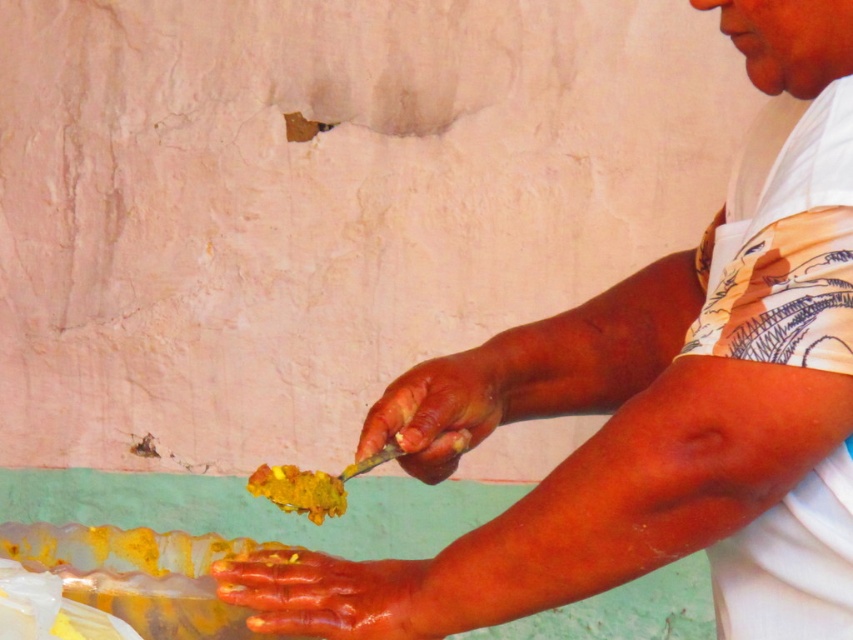
Does orange painted skin at lower center appear under yellowish matte paintbrush at center?

Correct, orange painted skin at lower center is located below yellowish matte paintbrush at center.

Can you confirm if orange painted skin at lower center is positioned to the left of yellowish matte paintbrush at center?

Yes, orange painted skin at lower center is to the left of yellowish matte paintbrush at center.

Locate an element on the screen. The image size is (853, 640). orange painted skin at lower center is located at coordinates point(325,595).

The width and height of the screenshot is (853, 640). Identify the location of orange painted skin at lower center. (325, 595).

What do you see at coordinates (444, 410) in the screenshot? I see `yellowish matte paintbrush at center` at bounding box center [444, 410].

How distant is yellowish matte paintbrush at center from yellow matte food at center?

yellowish matte paintbrush at center is 3.21 inches away from yellow matte food at center.

Where is `yellowish matte paintbrush at center`? yellowish matte paintbrush at center is located at coordinates (444, 410).

Is orange painted skin at lower center wider than yellow matte food at center?

Yes.

Between orange painted skin at lower center and yellow matte food at center, which one has less height?

yellow matte food at center

Between point (222, 579) and point (326, 502), which one is positioned in front?

Point (222, 579)

Locate an element on the screen. orange painted skin at lower center is located at coordinates (325, 595).